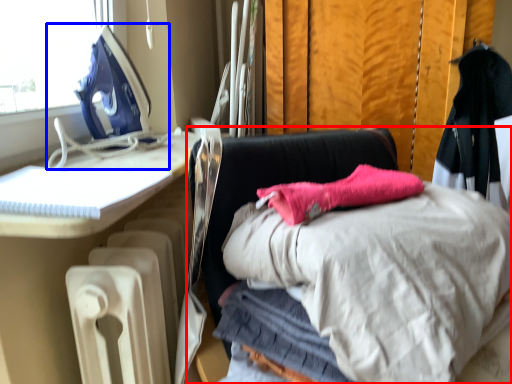
Question: Among these objects, which one is farthest to the camera, furniture (highlighted by a red box) or sewing machine (highlighted by a blue box)?

Choices:
 (A) furniture
 (B) sewing machine

Answer: (B)